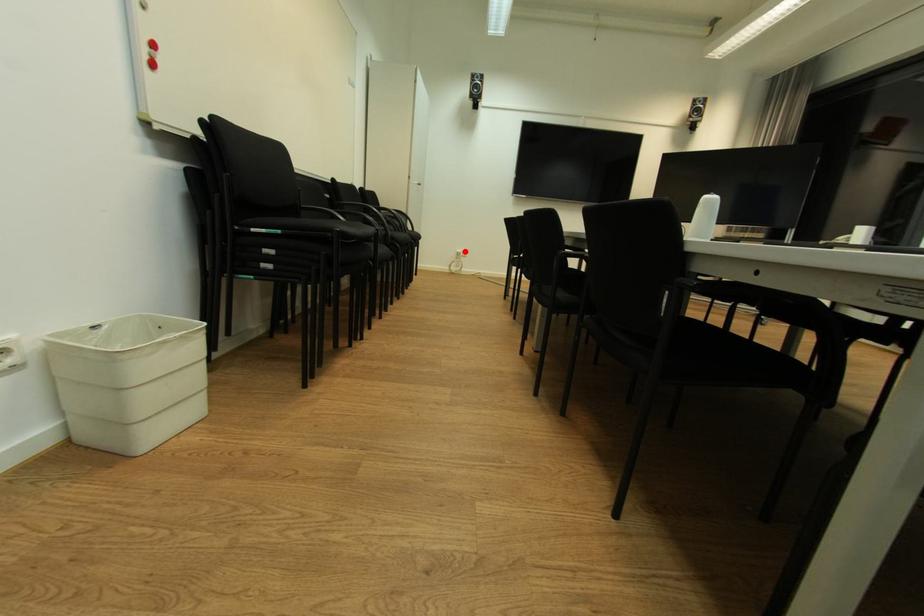
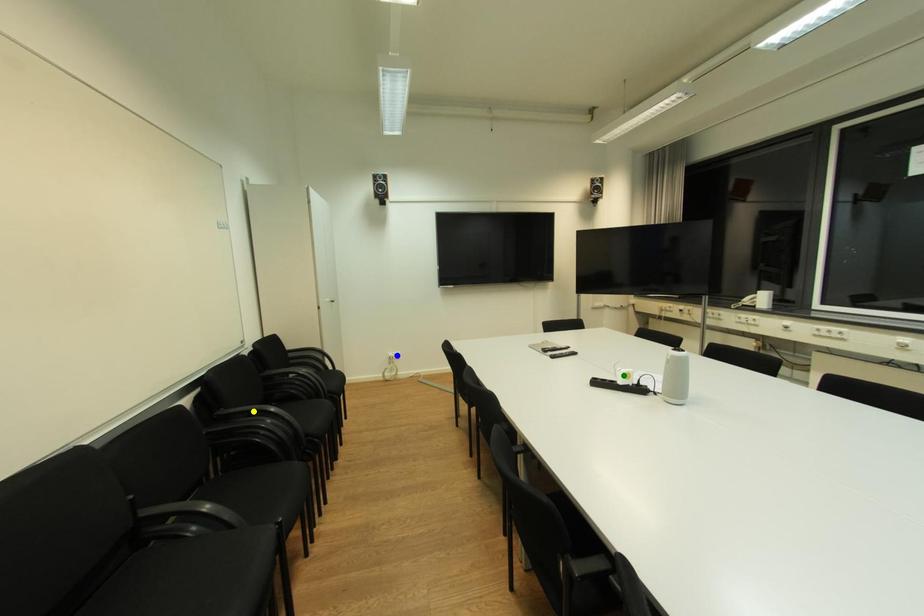
Question: I am providing you with two images of the same scene from different viewpoints. A red point is marked on the first image. You are given multiple points on the second image. In image 2, which mark is for the same physical point as the one in image 1?

Choices:
 (A) yellow point
 (B) blue point
 (C) green point

Answer: (B)